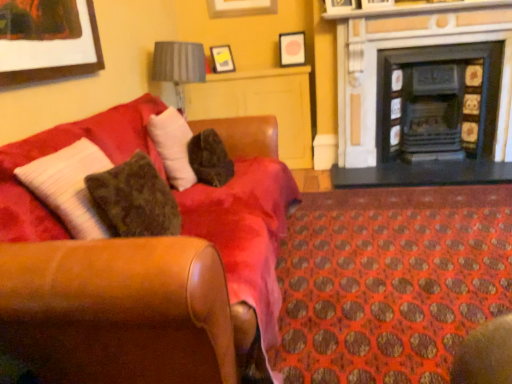
Question: From the image's perspective, is gray fabric lampshade at upper center located above or below matte yellow picture frame at upper center, which ranks as the 3th picture frame in top-to-bottom order?

Choices:
 (A) below
 (B) above

Answer: (A)

Question: In the image, is gray fabric lampshade at upper center on the left side or the right side of matte yellow picture frame at upper center, which ranks as the 3th picture frame in top-to-bottom order?

Choices:
 (A) right
 (B) left

Answer: (B)

Question: Estimate the real-world distances between objects in this image. Which object is closer to the leather couch at left?

Choices:
 (A) matte yellow picture frame at upper center, which ranks as the 3th picture frame in top-to-bottom order
 (B) matte black picture frame at upper center, which is the second picture frame from bottom to top
 (C) orange fabric carpet at lower right
 (D) black tile fireplace at upper right, which is the second fireplace in right-to-left order
 (E) matte wooden picture frame at upper center, which ranks as the first picture frame in top-to-bottom order

Answer: (C)

Question: Estimate the real-world distances between objects in this image. Which object is closer to the matte yellow picture frame at upper center, positioned as the 1th picture frame in bottom-to-top order?

Choices:
 (A) leather couch at left
 (B) matte black picture frame at upper center, which is the second picture frame from bottom to top
 (C) black tile fireplace at upper right, which is the second fireplace in right-to-left order
 (D) black matte fireplace at right, the 1th fireplace from the right
 (E) gray fabric lampshade at upper center

Answer: (B)